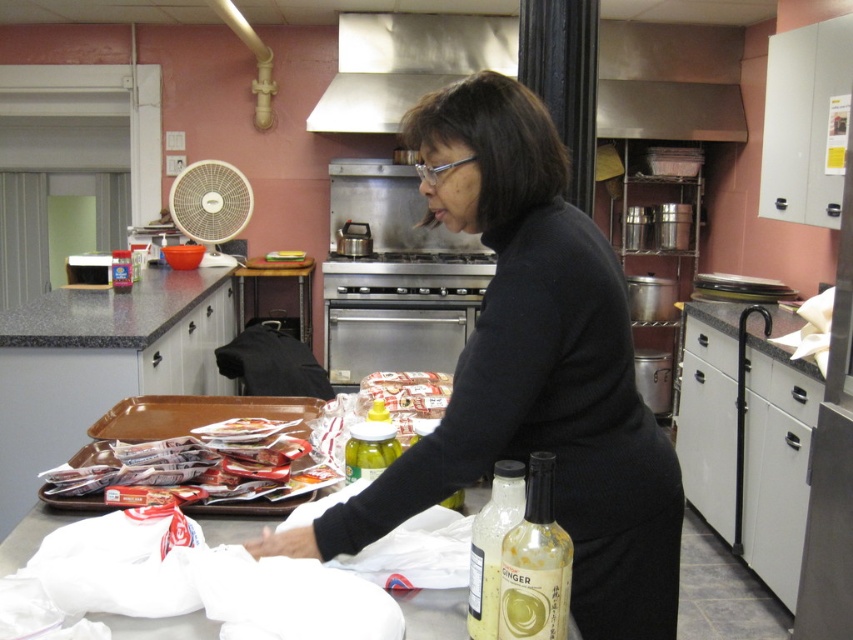
Does stainless steel exhaust hood at upper center have a smaller size compared to granite gray counter at center?

Yes, stainless steel exhaust hood at upper center is smaller than granite gray counter at center.

Which is behind, point (630, 38) or point (152, 275)?

The point (630, 38) is behind.

Does point (602, 54) come closer to viewer compared to point (170, 282)?

No, (602, 54) is further to viewer.

Image resolution: width=853 pixels, height=640 pixels. I want to click on stainless steel exhaust hood at upper center, so click(669, 81).

In the scene shown: Who is taller, black matte sweater at center or shiny plastic tray at lower left?

black matte sweater at center is taller.

Is black matte sweater at center closer to camera compared to shiny plastic tray at lower left?

Yes, it is.

Is point (665, 588) more distant than point (167, 419)?

No, (665, 588) is in front of (167, 419).

Locate an element on the screen. black matte sweater at center is located at coordinates (532, 371).

Is shiny plastic tray at lower left shorter than translucent glass ginger syrup at center?

Yes.

Does shiny plastic tray at lower left appear on the right side of translucent glass ginger syrup at center?

Incorrect, shiny plastic tray at lower left is not on the right side of translucent glass ginger syrup at center.

Who is more forward, (195, 512) or (515, 481)?

Point (515, 481) is in front.

I want to click on shiny plastic tray at lower left, so click(x=158, y=419).